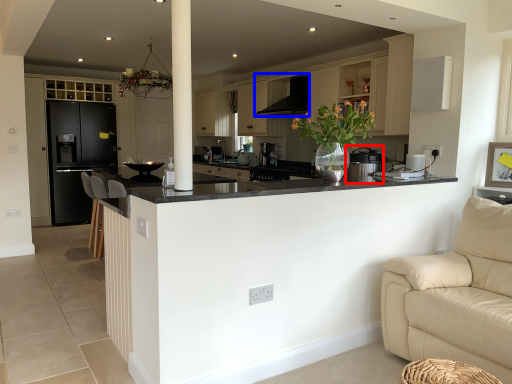
Question: Which object is further to the camera taking this photo, appliance (highlighted by a red box) or exhaust hood (highlighted by a blue box)?

Choices:
 (A) appliance
 (B) exhaust hood

Answer: (B)